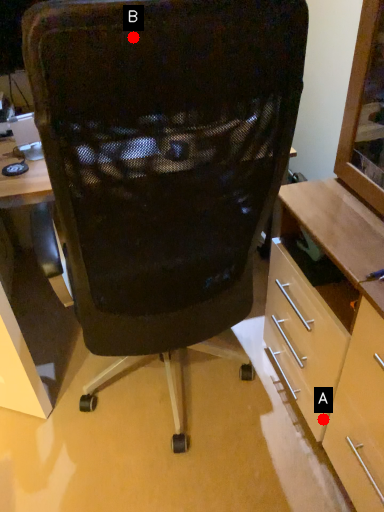
Question: Two points are circled on the image, labeled by A and B beside each circle. Which point is closer to the camera?

Choices:
 (A) A is closer
 (B) B is closer

Answer: (B)